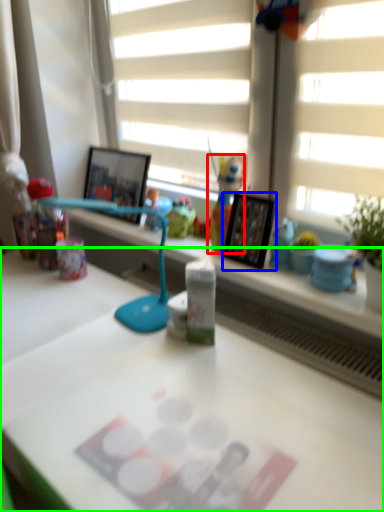
Question: Which object is the closest to the toy (highlighted by a red box)? Choose among these: picture frame (highlighted by a blue box) or desk (highlighted by a green box).

Choices:
 (A) picture frame
 (B) desk

Answer: (A)